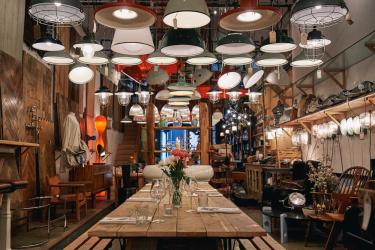
Where is `glass cups on table`? glass cups on table is located at coordinates (160, 187), (169, 180), (189, 182), (201, 198).